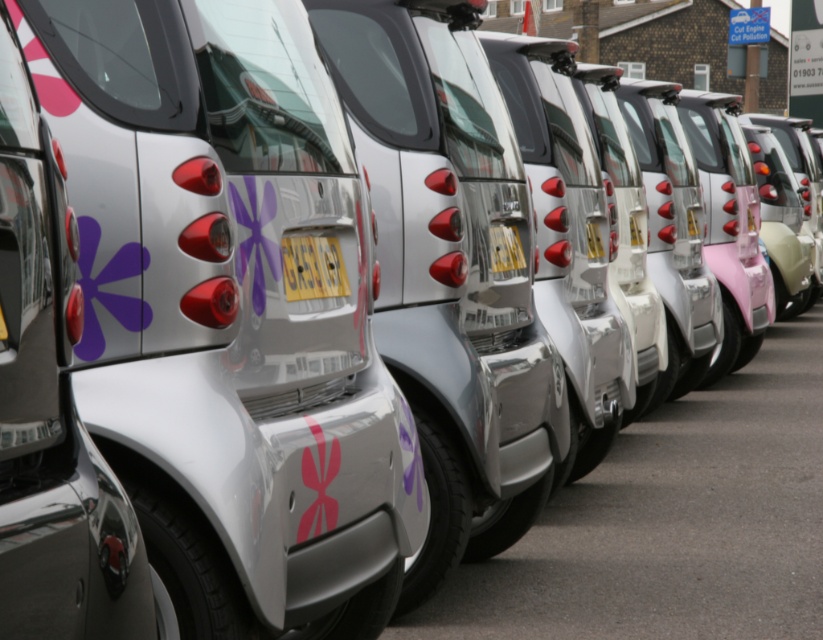
You are standing behind a row of cars and want to reach the yellow matte license plate at center. Is the metallic silver car at center blocking your path to it?

The metallic silver car at center is closer to the viewer than the yellow matte license plate at center, so the car is blocking the path to the license plate.

You are standing at the entrance of the parking lot and see the metallic silver car at center. Based on its position, can you determine if it is parked closer to the front or the back of the parking lot?

The metallic silver car at center is located at point (50, 406), which indicates it is closer to the back of the parking lot since the coordinates suggest it is positioned further away from the entrance.

You are standing behind a row of silver cars parked in a straight line. You notice two points marked on the cars. One is at point (26, 108) and the other at point (291, 246). Which point is closer to you?

The point at (26, 108) is closer to the viewer than the point at (291, 246).